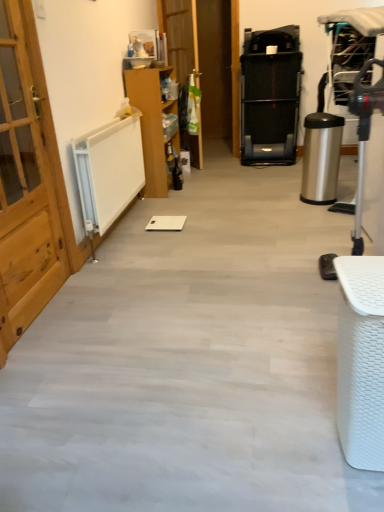
Question: From the image's perspective, is wooden cabinet at center, arranged as the second furniture when viewed from the right, above light wood door at left, the 2th door in the back-to-front sequence?

Choices:
 (A) no
 (B) yes

Answer: (B)

Question: Is wooden cabinet at center, the 2th furniture positioned from the front, looking in the opposite direction of light wood door at left, which is the first door in front-to-back order?

Choices:
 (A) yes
 (B) no

Answer: (B)

Question: Would you say wooden cabinet at center, which is counted as the second furniture, starting from the bottom, is outside light wood door at left, which is the first door in bottom-to-top order?

Choices:
 (A) yes
 (B) no

Answer: (A)

Question: From the image's perspective, does wooden cabinet at center, arranged as the second furniture when viewed from the right, appear lower than light wood door at left, marked as the first door in a left-to-right arrangement?

Choices:
 (A) no
 (B) yes

Answer: (A)

Question: Is wooden cabinet at center, arranged as the second furniture when viewed from the right, facing towards light wood door at left, marked as the first door in a left-to-right arrangement?

Choices:
 (A) no
 (B) yes

Answer: (A)

Question: Considering the positions of white woven basket at lower right, the 2th furniture in the top-to-bottom sequence, and wooden cabinet at center, which is counted as the first furniture, starting from the top, in the image, is white woven basket at lower right, the 2th furniture in the top-to-bottom sequence, taller or shorter than wooden cabinet at center, which is counted as the first furniture, starting from the top,?

Choices:
 (A) tall
 (B) short

Answer: (B)

Question: Is white woven basket at lower right, which is the first furniture in front-to-back order, inside the boundaries of wooden cabinet at center, which is counted as the second furniture, starting from the bottom, or outside?

Choices:
 (A) outside
 (B) inside

Answer: (A)

Question: In terms of width, does white woven basket at lower right, the first furniture when ordered from bottom to top, look wider or thinner when compared to wooden cabinet at center, arranged as the second furniture when viewed from the right?

Choices:
 (A) thin
 (B) wide

Answer: (A)

Question: From a real-world perspective, relative to wooden cabinet at center, the 2th furniture positioned from the front, is white woven basket at lower right, the 2th furniture in the top-to-bottom sequence, vertically above or below?

Choices:
 (A) above
 (B) below

Answer: (B)

Question: Is light wood door at left, the second door when ordered from top to bottom, spatially inside wooden door at center, the 1th door positioned from the right, or outside of it?

Choices:
 (A) outside
 (B) inside

Answer: (A)

Question: From a real-world perspective, relative to wooden door at center, which appears as the 2th door when ordered from the bottom, is light wood door at left, which is the first door in front-to-back order, vertically above or below?

Choices:
 (A) above
 (B) below

Answer: (B)

Question: Considering their positions, is light wood door at left, which is the first door in bottom-to-top order, located in front of or behind wooden door at center, which is the 1th door from top to bottom?

Choices:
 (A) front
 (B) behind

Answer: (A)

Question: From the image's perspective, is light wood door at left, the second door when ordered from top to bottom, located above or below wooden door at center, which is the 1th door from top to bottom?

Choices:
 (A) above
 (B) below

Answer: (B)

Question: In terms of height, does light wood door at left, which is the first door in bottom-to-top order, look taller or shorter compared to white woven basket at lower right, the 2th furniture in the top-to-bottom sequence?

Choices:
 (A) tall
 (B) short

Answer: (A)

Question: From a real-world perspective, relative to white woven basket at lower right, which is counted as the second furniture, starting from the left, is light wood door at left, which is the first door in bottom-to-top order, vertically above or below?

Choices:
 (A) below
 (B) above

Answer: (B)